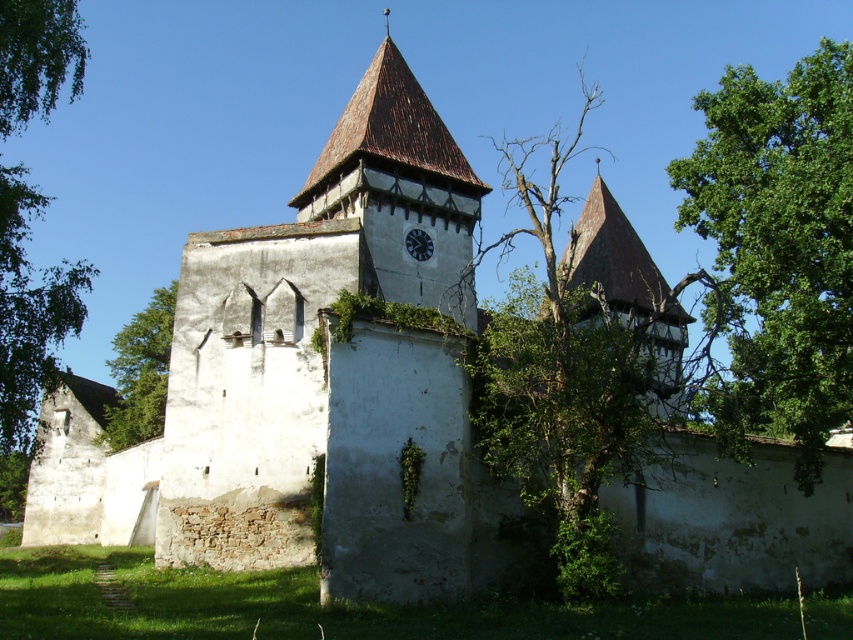
You are standing in front of the fortified church and want to know which tree is taller. You see the green leafy tree at upper right and the green leafy tree at left. Which one is taller?

The green leafy tree at left is taller than the green leafy tree at upper right.

You are standing in front of the fortified church and notice two green leafy trees in the scene. Which tree, the green leafy tree at upper right or the green leafy tree at left, is positioned lower in the image?

The green leafy tree at upper right is located below the green leafy tree at left, so it is positioned lower in the image.

You are standing in front of the fortified church and want to reach the point marked at coordinates point (730, 129). If your maximum comfortable walking distance is 50 meters, will you need to walk further than your comfort level to reach that point?

The point (730, 129) is 55.94 meters away from the viewer, which exceeds your maximum comfortable walking distance of 50 meters. Therefore, you will need to walk further than your comfort level to reach that point.